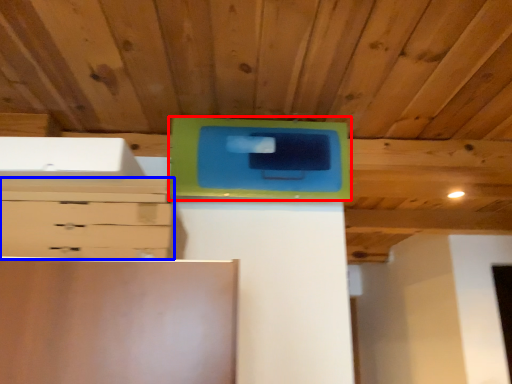
Question: Which of the following is the farthest to the observer, cabinetry (highlighted by a red box) or chest of drawers (highlighted by a blue box)?

Choices:
 (A) cabinetry
 (B) chest of drawers

Answer: (A)